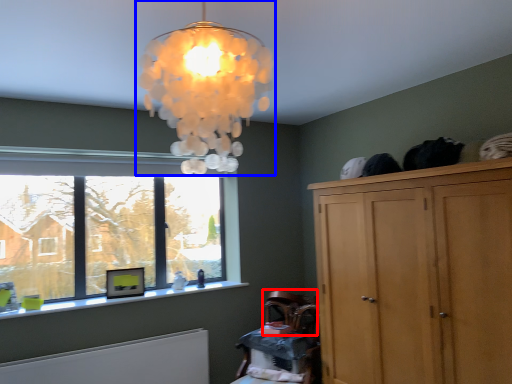
Question: Which object appears closest to the camera in this image, armchair (highlighted by a red box) or lamp (highlighted by a blue box)?

Choices:
 (A) armchair
 (B) lamp

Answer: (B)